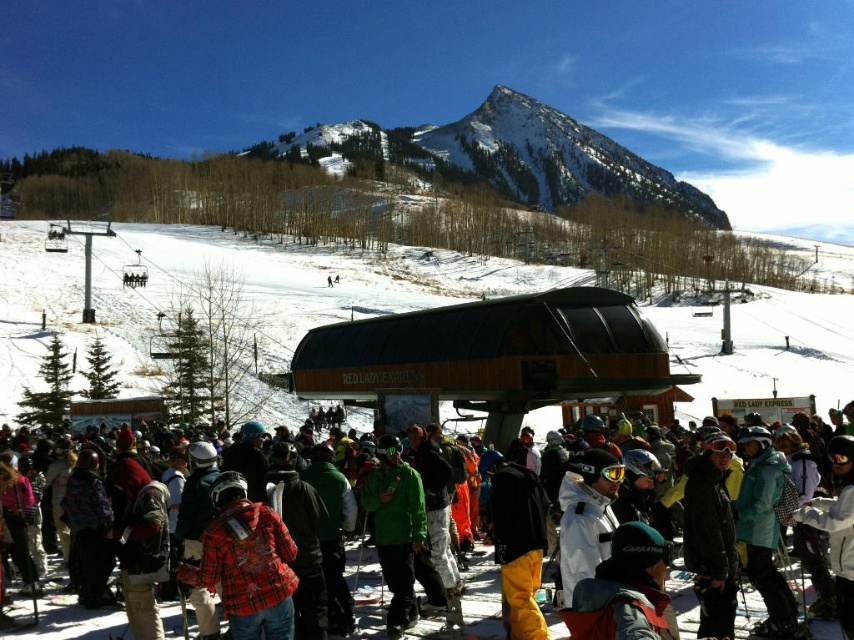
You are a skier standing at the top of the slope and see the white powdery snow at center and the green matte jacket at center. Which object is located higher up the slope?

The white powdery snow at center is positioned over the green matte jacket at center, so it is higher up the slope.